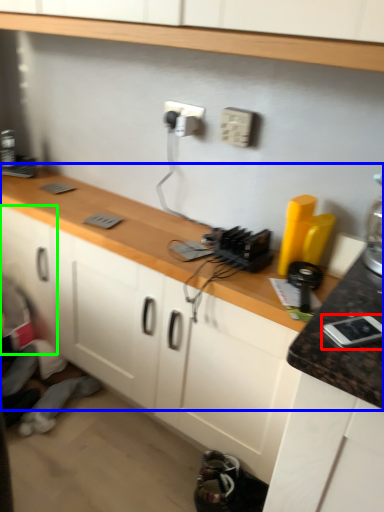
Question: Which is nearer to the appliance (highlighted by a red box)? countertop (highlighted by a blue box) or cabinetry (highlighted by a green box).

Choices:
 (A) countertop
 (B) cabinetry

Answer: (A)